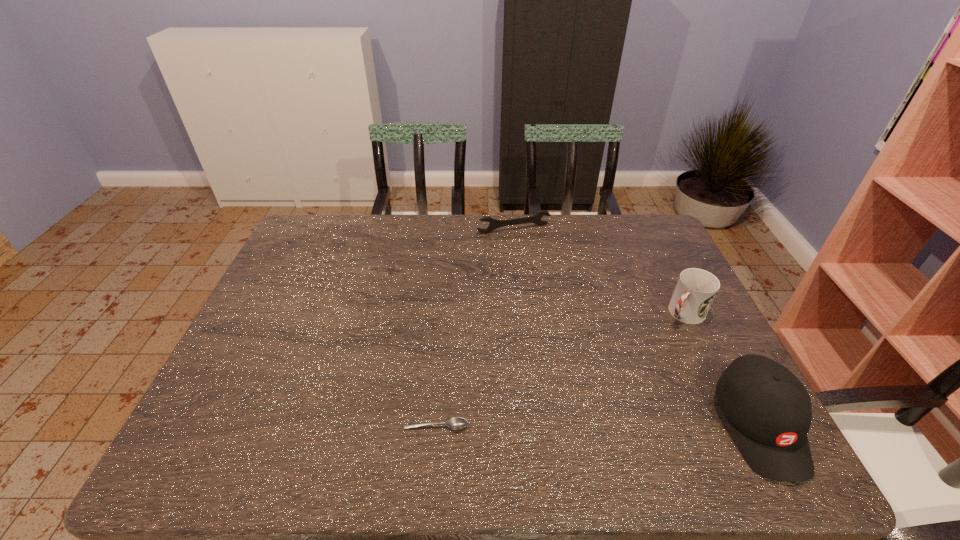
Locate an element on the screen. The width and height of the screenshot is (960, 540). the leftmost object is located at coordinates (456, 423).

At what (x,y) coordinates should I click in order to perform the action: click on the shortest object. Please return your answer as a coordinate pair (x, y). This screenshot has height=540, width=960. Looking at the image, I should click on (456, 423).

This screenshot has height=540, width=960. Find the location of `baseball cap`. baseball cap is located at coordinates (768, 408).

Locate an element on the screen. The height and width of the screenshot is (540, 960). cup is located at coordinates (695, 291).

At what (x,y) coordinates should I click in order to perform the action: click on wrench. Please return your answer as a coordinate pair (x, y). Image resolution: width=960 pixels, height=540 pixels. Looking at the image, I should click on (536, 219).

At what (x,y) coordinates should I click in order to perform the action: click on the farthest object. Please return your answer as a coordinate pair (x, y). Image resolution: width=960 pixels, height=540 pixels. Looking at the image, I should click on (536, 219).

Locate an element on the screen. The image size is (960, 540). free space located 0.360m on the left of the soupspoon is located at coordinates click(239, 426).

Identify the location of vacant area situated on the side of the cup where the handle is located. (663, 333).

Identify the location of vacant space located 0.160m on the side of the cup where the handle is located. This screenshot has width=960, height=540. (640, 355).

At what (x,y) coordinates should I click in order to perform the action: click on vacant region located 0.340m on the side of the cup where the handle is located. Please return your answer as a coordinate pair (x, y). The image size is (960, 540). Looking at the image, I should click on (597, 397).